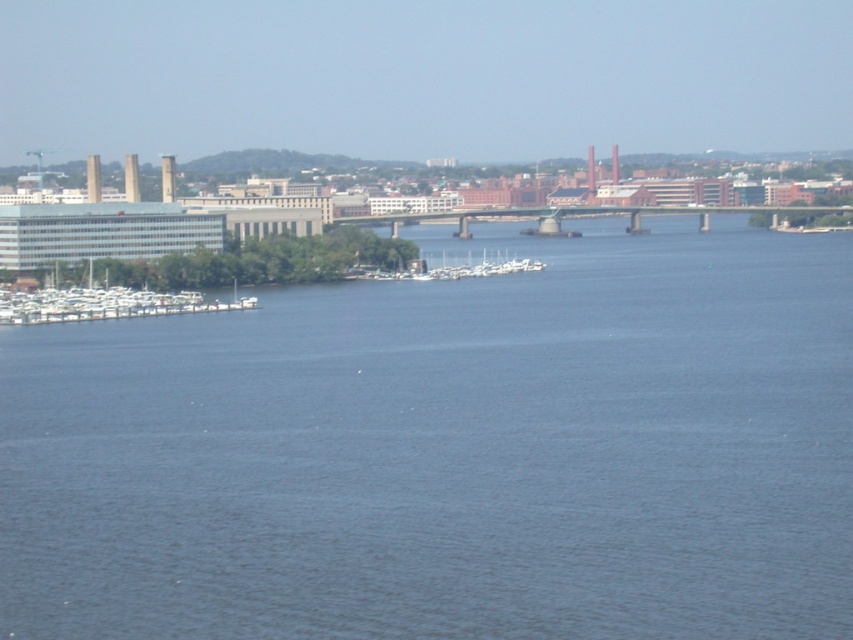
You are standing at the center of the marina and want to locate the white matte boats at left. According to their coordinates, in which direction should you look to find them?

The white matte boats at left are located at coordinates point (x=103, y=301). Since you are at the center, looking towards the left side of the marina will allow you to find them.

You are a boat owner looking to dock your vessel near the white matte boats at left and the white matte boats at center. Based on their positions, which boat group should you approach first if you want to dock closer to the buildings on the left side of the image?

You should approach the white matte boats at left first because they are positioned closer to the buildings on the left side of the image than the white matte boats at center.